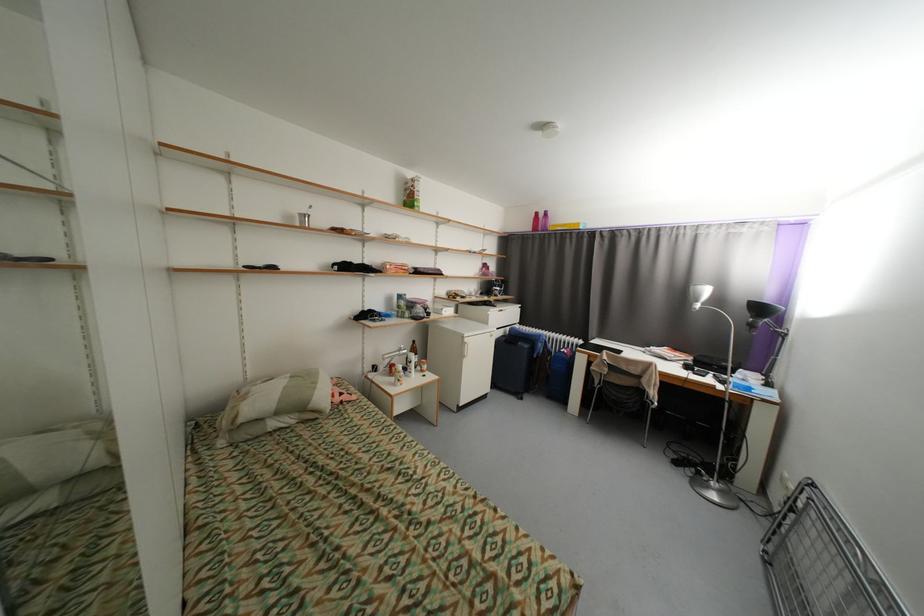
Identify the location of silver floor lamp head. (699, 296).